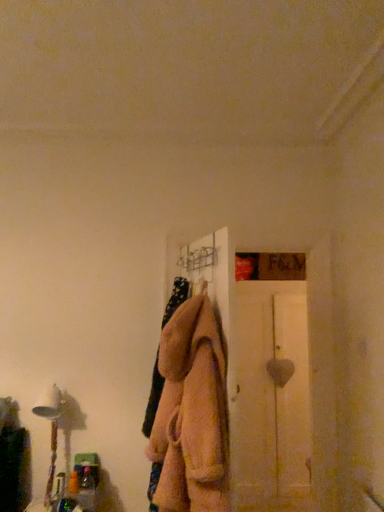
The height and width of the screenshot is (512, 384). What do you see at coordinates (192, 413) in the screenshot? I see `fuzzy beige coat at center` at bounding box center [192, 413].

This screenshot has height=512, width=384. I want to click on white fabric lampshade at left, so click(51, 437).

Considering the positions of objects fuzzy beige coat at center and white fabric lampshade at left in the image provided, who is more to the right, fuzzy beige coat at center or white fabric lampshade at left?

From the viewer's perspective, fuzzy beige coat at center appears more on the right side.

Who is taller, fuzzy beige coat at center or white fabric lampshade at left?

fuzzy beige coat at center.

From the image's perspective, which is below, fuzzy beige coat at center or white fabric lampshade at left?

From the image's view, white fabric lampshade at left is below.

Considering the positions of points (54, 404) and (293, 378), is point (54, 404) closer to camera compared to point (293, 378)?

Yes, point (54, 404) is in front of point (293, 378).

Is white fabric lampshade at left far away from white wooden door at right?

Absolutely, white fabric lampshade at left is distant from white wooden door at right.

Based on the photo, is white fabric lampshade at left turned away from white wooden door at right?

No.

Measure the distance from white fabric lampshade at left to white wooden door at right.

1.84 meters.

Is white fabric lampshade at left touching fuzzy beige coat at center?

They are not placed beside each other.

From a real-world perspective, between white fabric lampshade at left and fuzzy beige coat at center, who is vertically higher?

In real-world perspective, fuzzy beige coat at center is above.

Is white fabric lampshade at left oriented towards fuzzy beige coat at center?

No.

From the picture: Considering the sizes of objects fuzzy beige coat at center and white wooden door at right in the image provided, who is thinner, fuzzy beige coat at center or white wooden door at right?

fuzzy beige coat at center.

Could you tell me if fuzzy beige coat at center is facing white wooden door at right?

No, fuzzy beige coat at center is not facing towards white wooden door at right.

Can you confirm if fuzzy beige coat at center is bigger than white wooden door at right?

No, fuzzy beige coat at center is not bigger than white wooden door at right.

Is fuzzy beige coat at center taller than white wooden door at right?

In fact, fuzzy beige coat at center may be shorter than white wooden door at right.

Can you confirm if white wooden door at right is bigger than fuzzy beige coat at center?

Yes.

From the image's perspective, is white wooden door at right positioned above or below fuzzy beige coat at center?

Clearly, from the image's perspective, white wooden door at right is below fuzzy beige coat at center.

Is white wooden door at right oriented towards fuzzy beige coat at center?

No, white wooden door at right is not aimed at fuzzy beige coat at center.

Does point (251, 468) appear closer or farther from the camera than point (46, 413)?

Point (251, 468) is positioned farther from the camera compared to point (46, 413).

Locate an element on the screen. The height and width of the screenshot is (512, 384). table lamp in front of the white wooden door at right is located at coordinates (51, 437).

Are white wooden door at right and white fabric lampshade at left beside each other?

No, white wooden door at right is not in contact with white fabric lampshade at left.

How many degrees apart are the facing directions of white wooden door at right and white fabric lampshade at left?

The facing directions of white wooden door at right and white fabric lampshade at left are 1.72 degrees apart.

I want to click on clothing on the right side of white fabric lampshade at left, so click(192, 413).

At what (x,y) coordinates should I click in order to perform the action: click on screen door above the white fabric lampshade at left (from a real-world perspective). Please return your answer as a coordinate pair (x, y). The image size is (384, 512). Looking at the image, I should click on (271, 392).

Estimate the real-world distances between objects in this image. Which object is closer to white wooden door at right, white fabric lampshade at left or fuzzy beige coat at center?

white fabric lampshade at left.

Estimate the real-world distances between objects in this image. Which object is further from white fabric lampshade at left, white wooden door at right or fuzzy beige coat at center?

white wooden door at right is positioned further to the anchor white fabric lampshade at left.

Considering their positions, is fuzzy beige coat at center positioned closer to white fabric lampshade at left than white wooden door at right?

The object closer to white fabric lampshade at left is fuzzy beige coat at center.

Based on their spatial positions, is white fabric lampshade at left or white wooden door at right closer to fuzzy beige coat at center?

white fabric lampshade at left.

When comparing their distances from white wooden door at right, does fuzzy beige coat at center or white fabric lampshade at left seem closer?

white fabric lampshade at left is positioned closer to the anchor white wooden door at right.

When comparing their distances from fuzzy beige coat at center, does white wooden door at right or white fabric lampshade at left seem closer?

white fabric lampshade at left.

At what (x,y) coordinates should I click in order to perform the action: click on table lamp located between fuzzy beige coat at center and white wooden door at right in the depth direction. Please return your answer as a coordinate pair (x, y). Looking at the image, I should click on (51, 437).